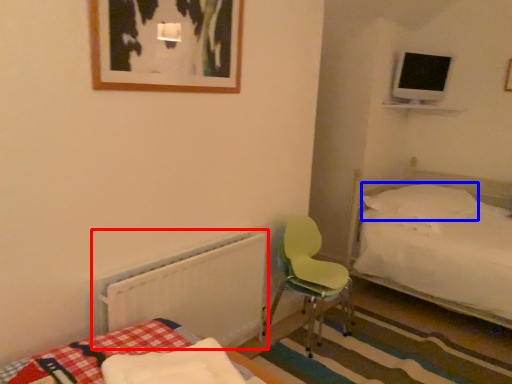
Question: Which of the following is the farthest to the observer, radiator (highlighted by a red box) or pillow (highlighted by a blue box)?

Choices:
 (A) radiator
 (B) pillow

Answer: (B)